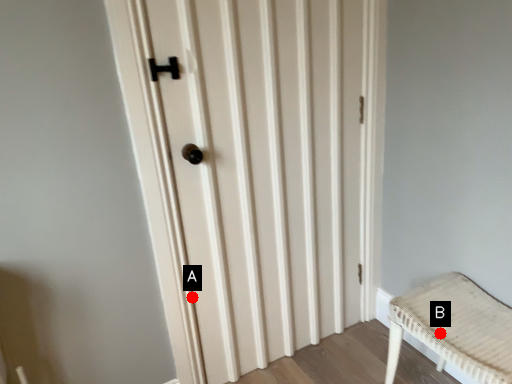
Question: Two points are circled on the image, labeled by A and B beside each circle. Which of the following is the closest to the observer?

Choices:
 (A) A is closer
 (B) B is closer

Answer: (B)